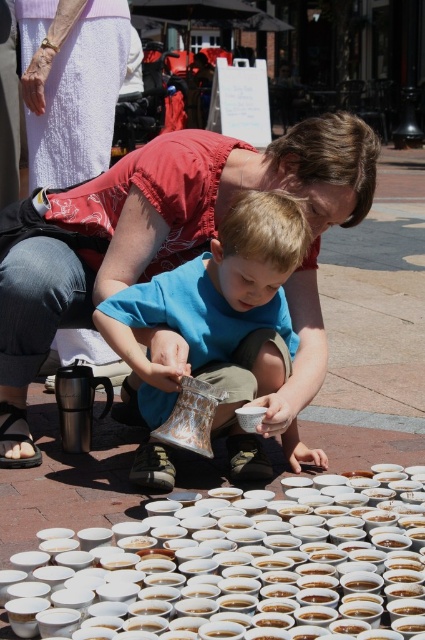
You are standing in the plaza where the woman and child are arranging cups. You need to place a new cup between the two points labeled point (116,252) and point (115,326). Which point should the cup be closer to in order to maintain the existing arrangement?

The cup should be placed closer to point (115,326) because point (116,252) is further away from the viewer, so maintaining the arrangement requires the new cup to align with the closer point.

You are a vendor at a street fair and have to arrange your items. You have white matte cups at lower center and a blue cotton shirt at center. Which item takes up more space on your display table?

The blue cotton shirt at center takes up more space on the display table because the white matte cups at lower center has a smaller size compared to it.